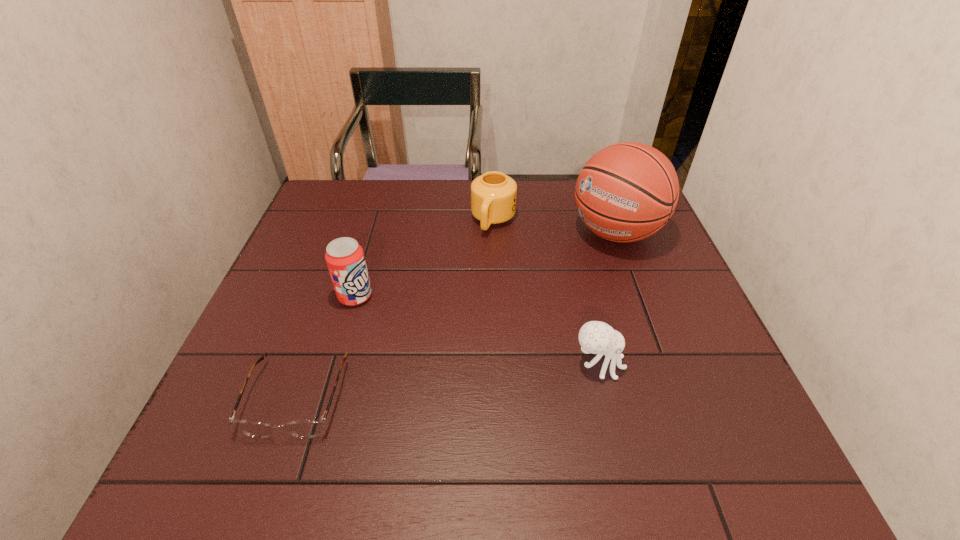
This screenshot has width=960, height=540. I want to click on spectacles, so pyautogui.click(x=308, y=428).

What are the coordinates of `octopus` in the screenshot? It's located at (596, 337).

This screenshot has height=540, width=960. I want to click on soda can, so click(x=345, y=259).

Where is `the fourth shortest object`? the fourth shortest object is located at coordinates (345, 259).

Find the location of a particular element. the third object from right to left is located at coordinates (493, 195).

This screenshot has height=540, width=960. In order to click on basketball in this screenshot , I will do `click(626, 192)`.

Find the location of `vacant space located on the front-facing side of the octopus`. vacant space located on the front-facing side of the octopus is located at coordinates (666, 364).

Identify the location of blank space located 0.160m on the surface of the third nearest object. (411, 339).

Find the location of a particular element. free spot located on the surface of the third nearest object is located at coordinates (388, 321).

The height and width of the screenshot is (540, 960). I want to click on vacant area located on the surface of the third nearest object, so click(x=385, y=319).